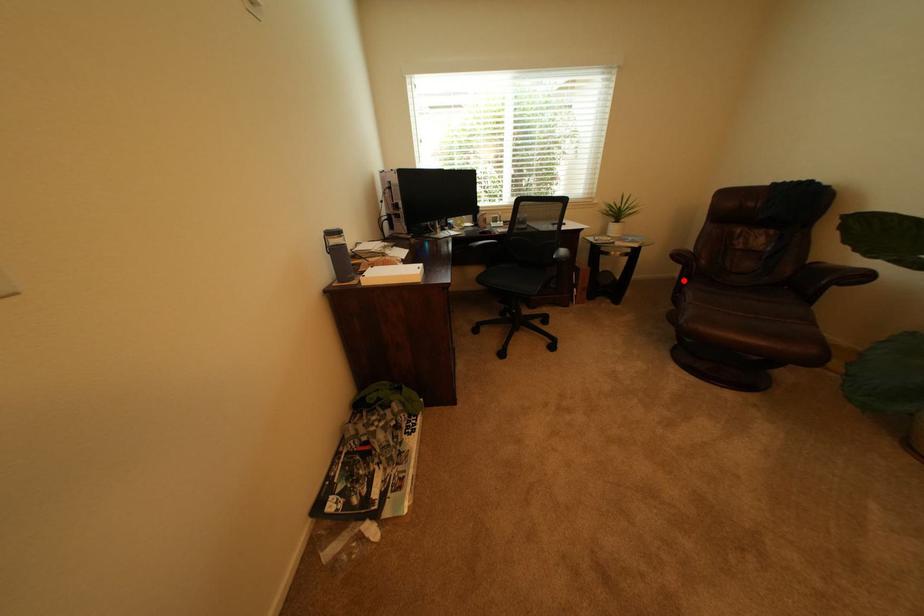
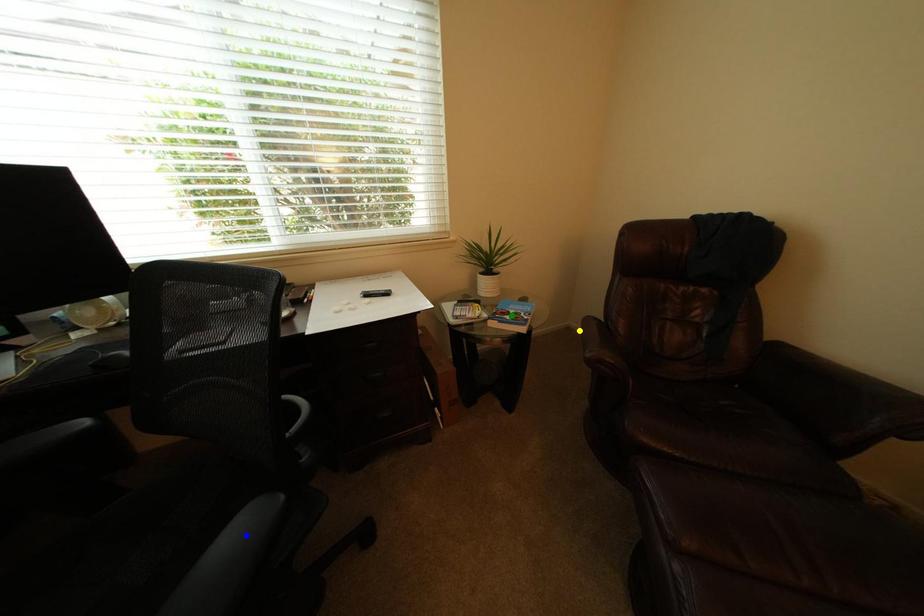
Question: I am providing you with two images of the same scene from different viewpoints. A red point is marked on the first image. You are given multiple points on the second image. Which point in image 2 is actually the same real-world point as the red point in image 1?

Choices:
 (A) green point
 (B) yellow point
 (C) blue point

Answer: (B)